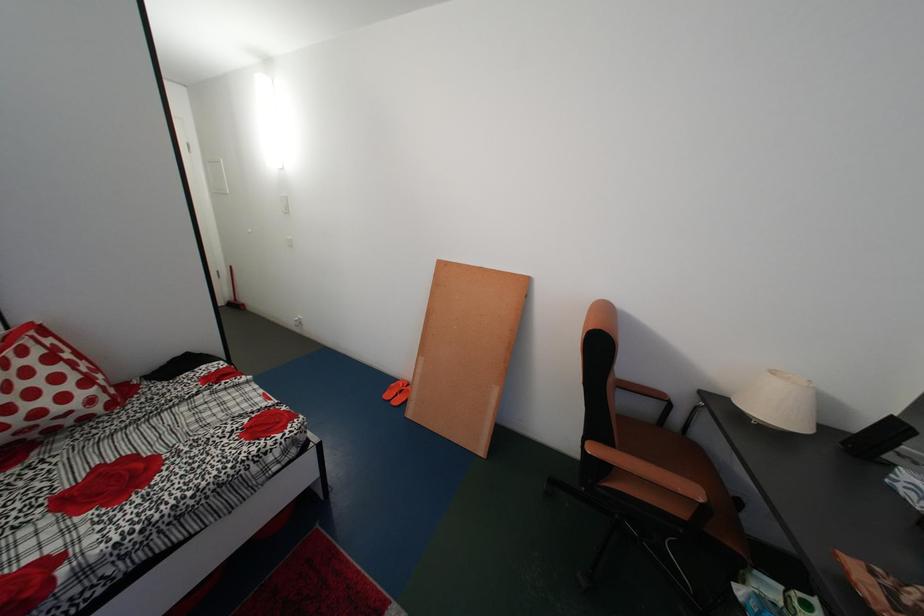
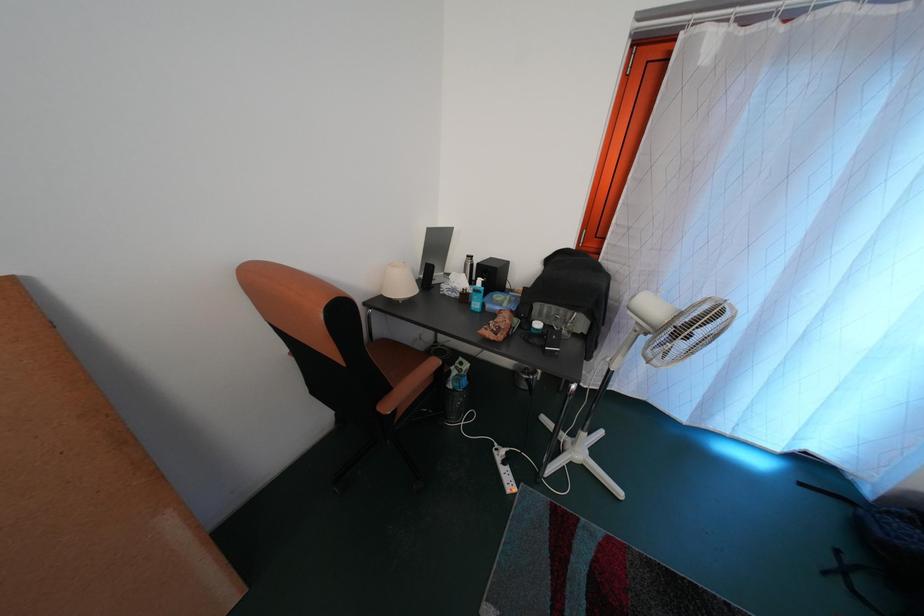
The images are taken continuously from a first-person perspective. In which direction is your viewpoint rotating?

The camera rotated toward right-down.